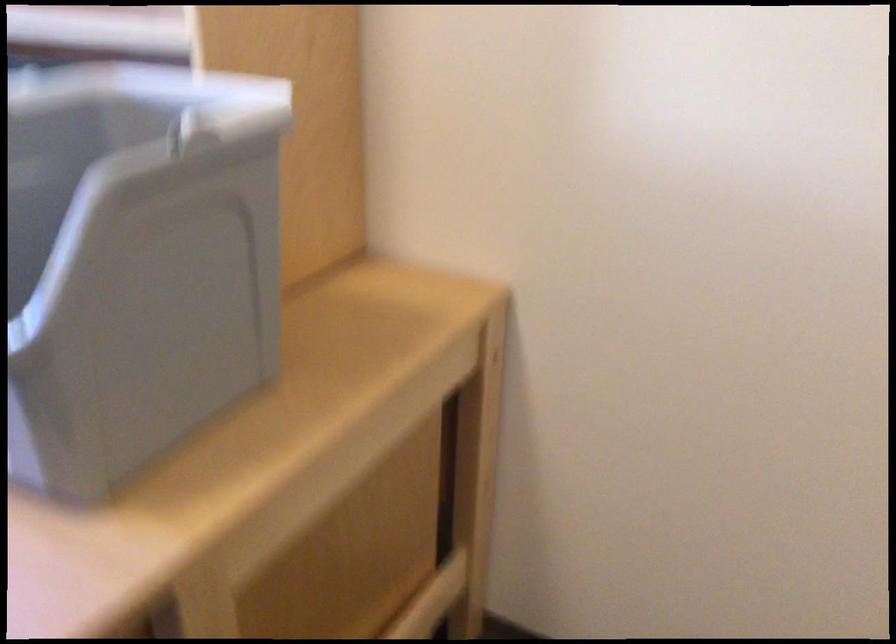
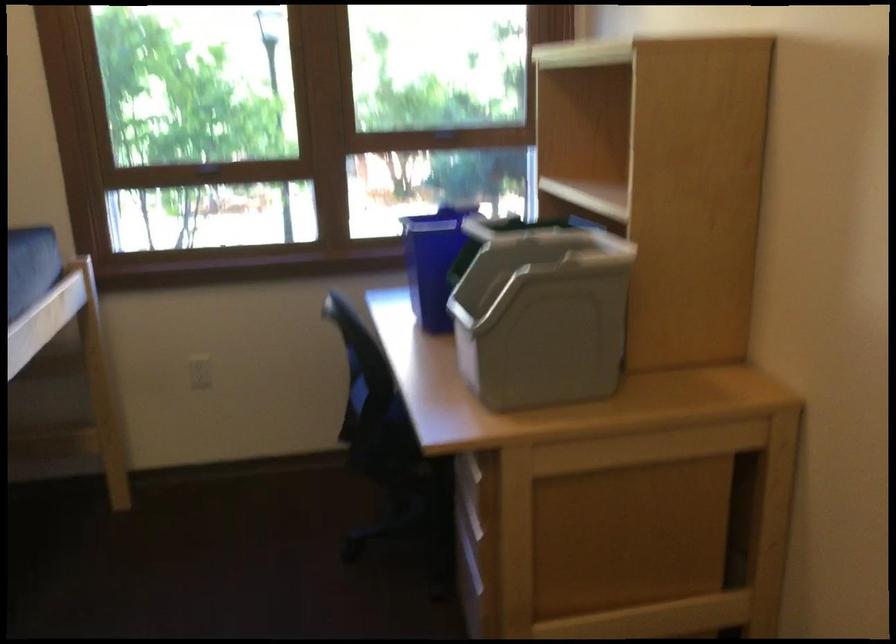
In the second image, find the point that corresponds to (x=153, y=259) in the first image.

(540, 313)